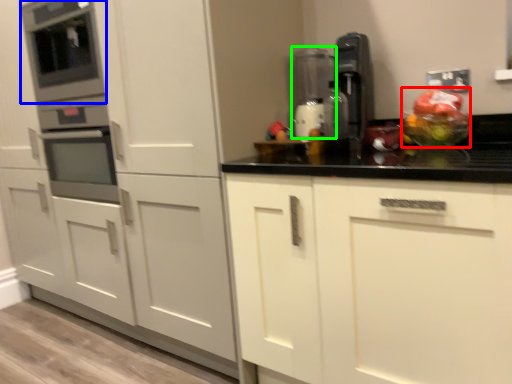
Question: Estimate the real-world distances between objects in this image. Which object is closer to fruit salad (highlighted by a red box), appliance (highlighted by a blue box) or appliance (highlighted by a green box)?

Choices:
 (A) appliance
 (B) appliance

Answer: (B)